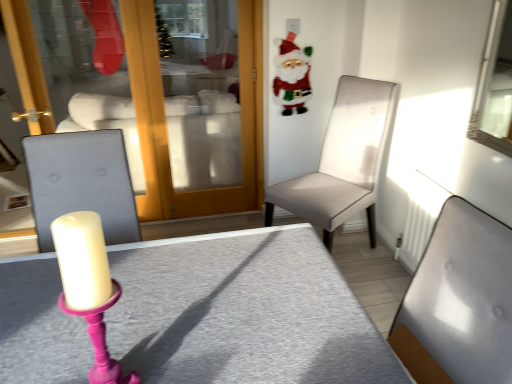
Measure the distance between point (309,221) and camera.

A distance of 7.67 feet exists between point (309,221) and camera.

The height and width of the screenshot is (384, 512). In order to click on gray fabric table at center in this screenshot , I will do `click(242, 312)`.

From a real-world perspective, which is physically above, gray fabric table at center or light gray fabric chair at center, the first chair when ordered from front to back?

From a 3D spatial view, light gray fabric chair at center, the first chair when ordered from front to back, is above.

Considering the relative sizes of gray fabric table at center and light gray fabric chair at center, which is counted as the second chair, starting from the back, in the image provided, is gray fabric table at center taller than light gray fabric chair at center, which is counted as the second chair, starting from the back,?

Yes.

From the image's perspective, starting from the gray fabric table at center, which chair is the 1st one above? Please provide its 2D coordinates.

[(459, 302)]

Does point (234, 349) appear closer or farther from the camera than point (509, 254)?

Point (234, 349) is positioned farther from the camera compared to point (509, 254).

Is the surface of gray fabric table at center in direct contact with felt santa claus at upper right?

No, gray fabric table at center is not touching felt santa claus at upper right.

Is gray fabric table at center to the right of felt santa claus at upper right from the viewer's perspective?

No, gray fabric table at center is not to the right of felt santa claus at upper right.

Measure the distance from gray fabric table at center to felt santa claus at upper right.

gray fabric table at center and felt santa claus at upper right are 1.71 meters apart.

Is gray fabric table at center turned away from felt santa claus at upper right?

No.

Between light gray fabric chair at center, the first chair when ordered from front to back, and gray fabric table at center, which one has more height?

gray fabric table at center.

Is light gray fabric chair at center, which is counted as the second chair, starting from the back, positioned far away from gray fabric table at center?

They are positioned close to each other.

Is light gray fabric chair at center, which is counted as the second chair, starting from the back, to the right of gray fabric table at center from the viewer's perspective?

Yes.

Is light gray fabric chair at center, which is counted as the second chair, starting from the back, smaller than gray fabric table at center?

Yes, light gray fabric chair at center, which is counted as the second chair, starting from the back, is smaller than gray fabric table at center.

Consider the image. Is felt santa claus at upper right not within light gray fabric chair at center, the first chair when ordered from front to back?

Absolutely, felt santa claus at upper right is external to light gray fabric chair at center, the first chair when ordered from front to back.

In terms of height, does felt santa claus at upper right look taller or shorter compared to light gray fabric chair at center, the first chair when ordered from front to back?

felt santa claus at upper right is shorter than light gray fabric chair at center, the first chair when ordered from front to back.

Considering the sizes of objects felt santa claus at upper right and light gray fabric chair at center, which is counted as the second chair, starting from the back, in the image provided, who is smaller, felt santa claus at upper right or light gray fabric chair at center, which is counted as the second chair, starting from the back,?

With smaller size is felt santa claus at upper right.

Does light gray fabric chair at center, which is counted as the second chair, starting from the back, turn towards light beige fabric chair at center right, which is the 1th chair in back-to-front order?

No, light gray fabric chair at center, which is counted as the second chair, starting from the back, is not aimed at light beige fabric chair at center right, which is the 1th chair in back-to-front order.

Would you say light gray fabric chair at center, which is counted as the second chair, starting from the back, is outside light beige fabric chair at center right, which is the second chair from front to back?

Indeed, light gray fabric chair at center, which is counted as the second chair, starting from the back, is completely outside light beige fabric chair at center right, which is the second chair from front to back.

Does point (479, 341) come farther from viewer compared to point (369, 153)?

That is False.

Is light gray fabric chair at center, which is counted as the second chair, starting from the back, wider or thinner than light beige fabric chair at center right, which is the second chair from front to back?

In the image, light gray fabric chair at center, which is counted as the second chair, starting from the back, appears to be more narrow than light beige fabric chair at center right, which is the second chair from front to back.

Is light beige fabric chair at center right, which is the 1th chair in back-to-front order, in front of light gray fabric chair at center, which is counted as the second chair, starting from the back?

That is False.

Is light beige fabric chair at center right, which is the second chair from front to back, situated inside light gray fabric chair at center, the first chair when ordered from front to back, or outside?

light beige fabric chair at center right, which is the second chair from front to back, is located beyond the bounds of light gray fabric chair at center, the first chair when ordered from front to back.

The image size is (512, 384). Find the location of `chair below the light gray fabric chair at center, the first chair when ordered from front to back (from a real-world perspective)`. chair below the light gray fabric chair at center, the first chair when ordered from front to back (from a real-world perspective) is located at coordinates (342, 161).

Would you say light beige fabric chair at center right, which is the second chair from front to back, is a long distance from light gray fabric chair at center, the first chair when ordered from front to back?

light beige fabric chair at center right, which is the second chair from front to back, is positioned a significant distance from light gray fabric chair at center, the first chair when ordered from front to back.

Is the depth of light beige fabric chair at center right, which is the second chair from front to back, greater than that of gray fabric table at center?

That is True.

Is gray fabric table at center at the back of light beige fabric chair at center right, which is the second chair from front to back?

No.

Are light beige fabric chair at center right, which is the second chair from front to back, and gray fabric table at center located far from each other?

light beige fabric chair at center right, which is the second chair from front to back, is positioned a significant distance from gray fabric table at center.

From their relative heights in the image, would you say light beige fabric chair at center right, which is the second chair from front to back, is taller or shorter than gray fabric table at center?

Clearly, light beige fabric chair at center right, which is the second chair from front to back, is taller compared to gray fabric table at center.

In order to click on chair that is the 1st one when counting rightward from the gray fabric table at center in this screenshot , I will do `click(459, 302)`.

The image size is (512, 384). I want to click on santa claus above the gray fabric table at center (from the image's perspective), so click(x=292, y=76).

Estimate the real-world distances between objects in this image. Which object is further from light beige fabric chair at center right, which is the 1th chair in back-to-front order, gray fabric table at center or felt santa claus at upper right?

Among the two, gray fabric table at center is located further to light beige fabric chair at center right, which is the 1th chair in back-to-front order.

From the picture: From the image, which object appears to be nearer to felt santa claus at upper right, light gray fabric chair at center, which is counted as the second chair, starting from the back, or gray fabric table at center?

gray fabric table at center is closer to felt santa claus at upper right.

Looking at the image, which one is located further to light beige fabric chair at center right, which is the second chair from front to back, felt santa claus at upper right or light gray fabric chair at center, which is counted as the second chair, starting from the back?

Among the two, light gray fabric chair at center, which is counted as the second chair, starting from the back, is located further to light beige fabric chair at center right, which is the second chair from front to back.

When comparing their distances from light beige fabric chair at center right, which is the second chair from front to back, does light gray fabric chair at center, which is counted as the second chair, starting from the back, or gray fabric table at center seem further?

Based on the image, light gray fabric chair at center, which is counted as the second chair, starting from the back, appears to be further to light beige fabric chair at center right, which is the second chair from front to back.

Based on their spatial positions, is light beige fabric chair at center right, which is the second chair from front to back, or light gray fabric chair at center, which is counted as the second chair, starting from the back, closer to felt santa claus at upper right?

light beige fabric chair at center right, which is the second chair from front to back.

Which object lies nearer to the anchor point gray fabric table at center, felt santa claus at upper right or light beige fabric chair at center right, which is the 1th chair in back-to-front order?

light beige fabric chair at center right, which is the 1th chair in back-to-front order, is positioned closer to the anchor gray fabric table at center.

From the image, which object appears to be farther from felt santa claus at upper right, light beige fabric chair at center right, which is the 1th chair in back-to-front order, or gray fabric table at center?

gray fabric table at center is further to felt santa claus at upper right.

Which object lies nearer to the anchor point light gray fabric chair at center, which is counted as the second chair, starting from the back, gray fabric table at center or light beige fabric chair at center right, which is the 1th chair in back-to-front order?

gray fabric table at center is closer to light gray fabric chair at center, which is counted as the second chair, starting from the back.

The image size is (512, 384). Find the location of `chair positioned between gray fabric table at center and light beige fabric chair at center right, which is the second chair from front to back, from near to far`. chair positioned between gray fabric table at center and light beige fabric chair at center right, which is the second chair from front to back, from near to far is located at coordinates (459, 302).

You are a GUI agent. You are given a task and a screenshot of the screen. Output one action in this format:
    pyautogui.click(x=<x>, y=<y>)
    Task: Click on the chair positioned between light gray fabric chair at center, the first chair when ordered from front to back, and felt santa claus at upper right from near to far
    The image size is (512, 384).
    Given the screenshot: What is the action you would take?
    pyautogui.click(x=342, y=161)